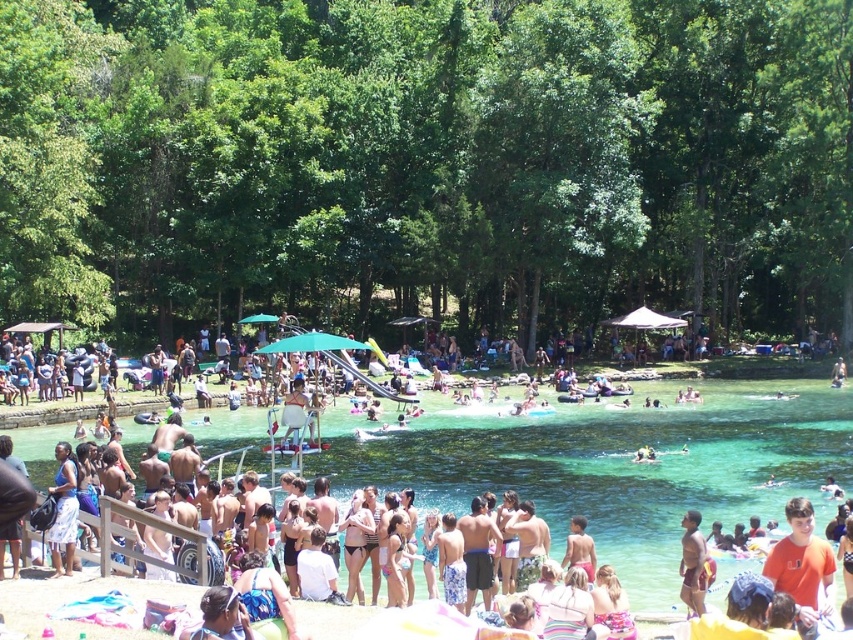
Describe the element at coordinates (618, 467) in the screenshot. I see `clear water at center` at that location.

Who is higher up, clear water at center or tan skin human at lower right?

clear water at center

I want to click on clear water at center, so click(618, 467).